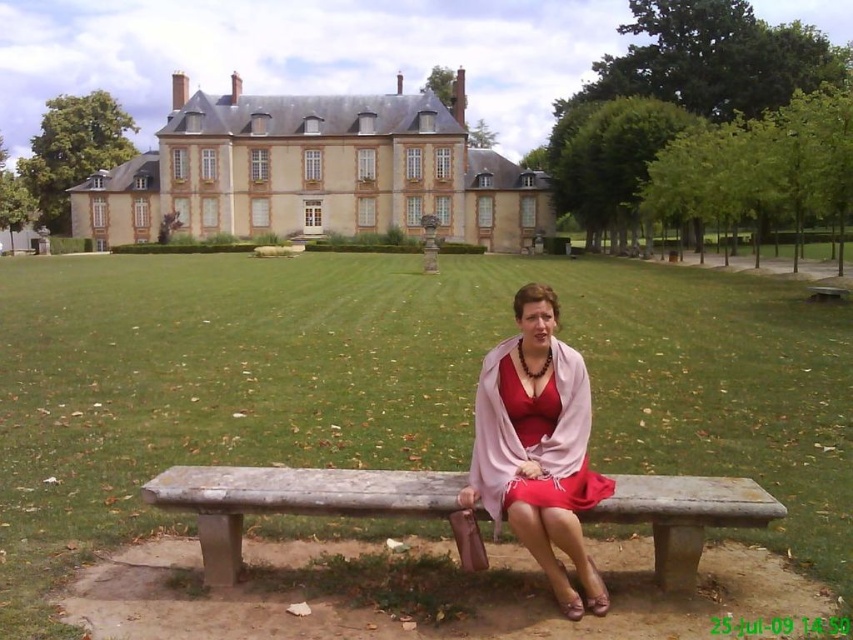
You are a photographer setting up a tripod to take a portrait of the woman sitting on the stone bench at center. You notice the matte pink shawl at center is partially blocking the view. Can you adjust the tripod height so that the shawl at center doesn not obstruct the woman? Explain your reasoning.

The stone bench at center is shorter than the matte pink shawl at center. Since the bench is lower, raising the tripod to a height above the bench but below the shawl might still allow the shawl to block the view. Alternatively, lowering the tripod below the shawl height could position the camera below the shawl, capturing the woman without obstruction. However, the exact adjustment depends on the shawl placement and bench height difference.

You are standing at the point marked as point (314, 172) in the image. What structure is directly in front of you?

The point (314, 172) corresponds to the beige stone palace at upper center, so the beige stone palace at upper center is directly in front of you.

You are a photographer setting up a shot of the woman on the stone bench at center and the matte pink shawl at center. You want to ensure the shawl appears to the right of the bench in the final image. Is the current arrangement correct?

The stone bench at center is to the left of the matte pink shawl at center, so the current arrangement already has the shawl to the right of the bench. Therefore, the photographer does not need to adjust the setup.